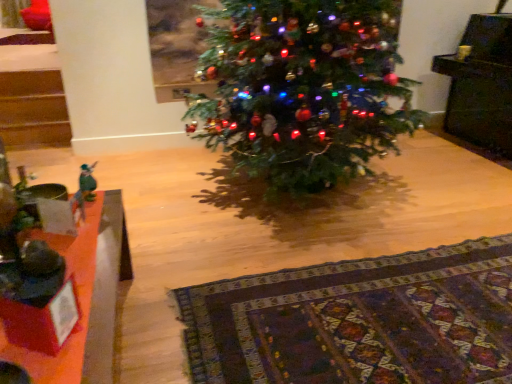
This screenshot has height=384, width=512. I want to click on empty space that is ontop of patterned wool rug at lower center (from a real-world perspective), so click(x=354, y=326).